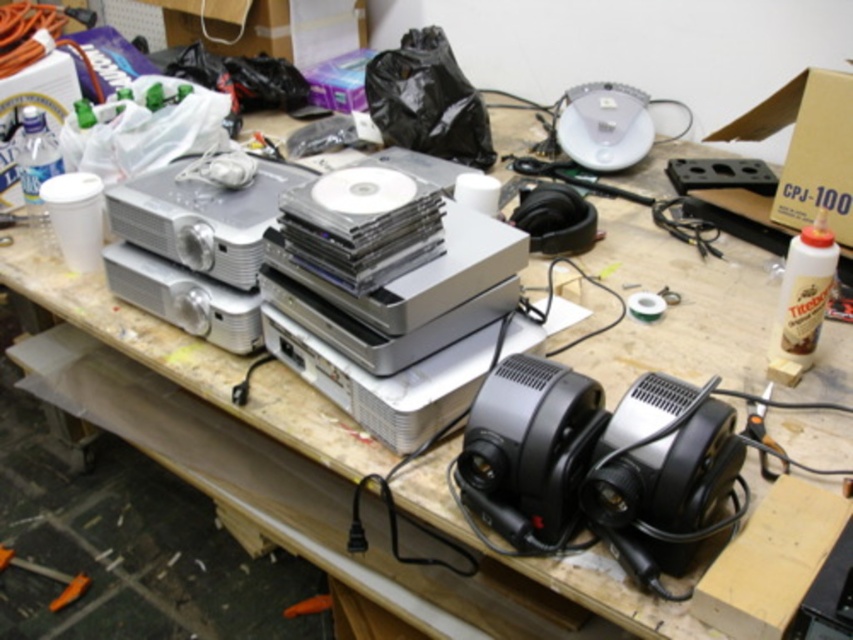
This screenshot has width=853, height=640. I want to click on black plastic speaker at center, so click(x=531, y=449).

What are the coordinates of `black plastic speaker at center` in the screenshot? It's located at (531, 449).

Who is more distant from viewer, (722,456) or (236,323)?

The point (236,323) is behind.

Identify the location of black plastic speaker at lower right. (664, 467).

Can you confirm if black plastic speaker at lower right is positioned above black plastic speaker at center?

Incorrect, black plastic speaker at lower right is not positioned above black plastic speaker at center.

Does black plastic speaker at lower right have a smaller size compared to black plastic speaker at center?

Incorrect, black plastic speaker at lower right is not smaller in size than black plastic speaker at center.

Does point (614, 420) lie behind point (486, 403)?

No, (614, 420) is closer to viewer.

At what (x,y) coordinates should I click in order to perform the action: click on black plastic speaker at lower right. Please return your answer as a coordinate pair (x, y). This screenshot has height=640, width=853. Looking at the image, I should click on (664, 467).